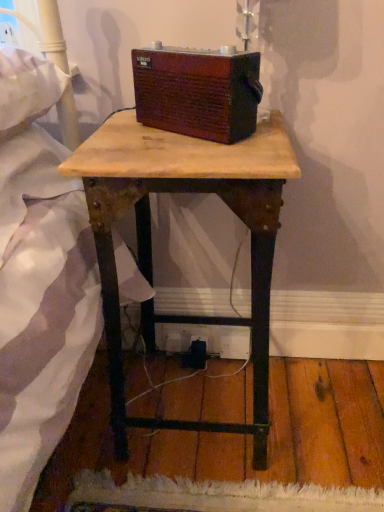
Where is `space that is in front of brown wood radio at center`? space that is in front of brown wood radio at center is located at coordinates (198, 146).